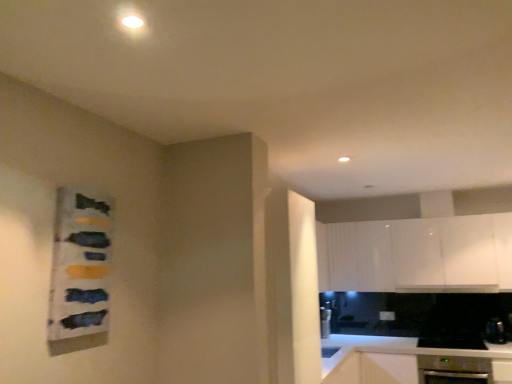
Question: Is white glossy countertop at lower right at the right side of satin black oven at lower right, which ranks as the second appliance in left-to-right order?

Choices:
 (A) yes
 (B) no

Answer: (B)

Question: Is white glossy countertop at lower right in front of satin black oven at lower right, which ranks as the second appliance in left-to-right order?

Choices:
 (A) no
 (B) yes

Answer: (B)

Question: Does white glossy countertop at lower right have a smaller size compared to satin black oven at lower right, which ranks as the second appliance in left-to-right order?

Choices:
 (A) no
 (B) yes

Answer: (A)

Question: Does white glossy countertop at lower right have a greater width compared to satin black oven at lower right, which ranks as the second appliance in left-to-right order?

Choices:
 (A) yes
 (B) no

Answer: (A)

Question: Considering the relative positions of white glossy countertop at lower right and satin black oven at lower right, the 1th appliance in the right-to-left sequence, in the image provided, is white glossy countertop at lower right to the left of satin black oven at lower right, the 1th appliance in the right-to-left sequence, from the viewer's perspective?

Choices:
 (A) no
 (B) yes

Answer: (B)

Question: From the image's perspective, is white glossy cabinet at upper right located above or below satin silver dishwasher at lower right?

Choices:
 (A) above
 (B) below

Answer: (A)

Question: Looking at their shapes, would you say white glossy cabinet at upper right is wider or thinner than satin silver dishwasher at lower right?

Choices:
 (A) wide
 (B) thin

Answer: (B)

Question: Is white glossy cabinet at upper right taller or shorter than satin silver dishwasher at lower right?

Choices:
 (A) short
 (B) tall

Answer: (B)

Question: Is white glossy cabinet at upper right situated inside satin silver dishwasher at lower right or outside?

Choices:
 (A) outside
 (B) inside

Answer: (A)

Question: Is white glossy countertop at lower right taller or shorter than satin silver dishwasher at lower right?

Choices:
 (A) tall
 (B) short

Answer: (A)

Question: Based on their positions, is white glossy countertop at lower right located to the left or right of satin silver dishwasher at lower right?

Choices:
 (A) left
 (B) right

Answer: (A)

Question: Looking at the image, does white glossy countertop at lower right seem bigger or smaller compared to satin silver dishwasher at lower right?

Choices:
 (A) big
 (B) small

Answer: (A)

Question: From the image's perspective, is white glossy countertop at lower right located above or below satin silver dishwasher at lower right?

Choices:
 (A) above
 (B) below

Answer: (B)

Question: From a real-world perspective, is white glossy cabinet at upper right physically located above or below satin black oven at lower right, which ranks as the second appliance in left-to-right order?

Choices:
 (A) below
 (B) above

Answer: (B)

Question: From the image's perspective, is white glossy cabinet at upper right located above or below satin black oven at lower right, which ranks as the second appliance in left-to-right order?

Choices:
 (A) below
 (B) above

Answer: (B)